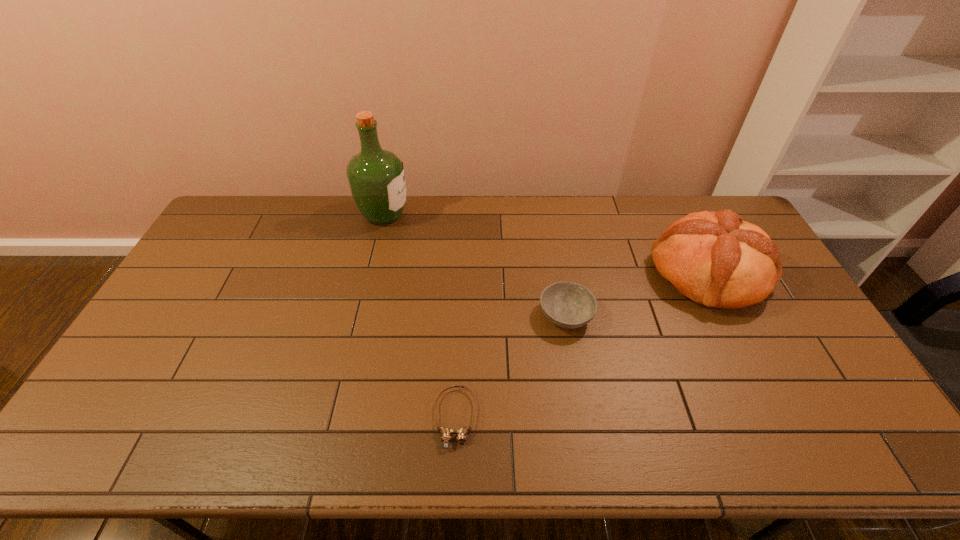
Where is `free space between the farthest object and the second shortest object`? The width and height of the screenshot is (960, 540). free space between the farthest object and the second shortest object is located at coordinates (475, 265).

The width and height of the screenshot is (960, 540). I want to click on vacant space in between the goggles and the rightmost object, so click(582, 346).

Locate an element on the screen. The width and height of the screenshot is (960, 540). empty location between the shortest object and the tallest object is located at coordinates 420,316.

Where is `free spot between the third object from left to right and the rightmost object`? This screenshot has height=540, width=960. free spot between the third object from left to right and the rightmost object is located at coordinates coord(636,294).

The image size is (960, 540). In order to click on free space between the goggles and the liquor in this screenshot , I will do `click(420, 316)`.

Locate an element on the screen. Image resolution: width=960 pixels, height=540 pixels. vacant area between the farthest object and the nearest object is located at coordinates (420, 316).

At what (x,y) coordinates should I click in order to perform the action: click on unoccupied position between the leftmost object and the nearest object. Please return your answer as a coordinate pair (x, y). This screenshot has height=540, width=960. Looking at the image, I should click on (420, 316).

Where is `free space that is in between the second tallest object and the liquor`? This screenshot has height=540, width=960. free space that is in between the second tallest object and the liquor is located at coordinates (546, 244).

This screenshot has width=960, height=540. Identify the location of free space between the leftmost object and the bowl. (475, 265).

At what (x,y) coordinates should I click in order to perform the action: click on free point between the farthest object and the second shortest object. Please return your answer as a coordinate pair (x, y). Looking at the image, I should click on (475, 265).